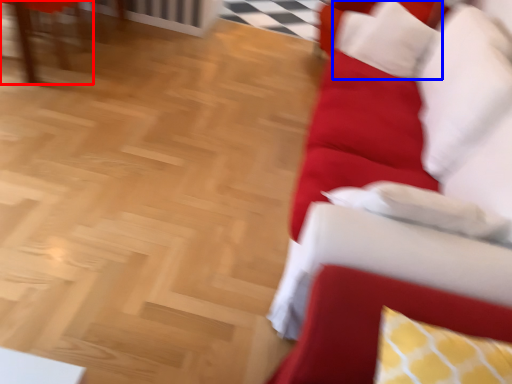
Question: Which point is further to the camera, furniture (highlighted by a red box) or pillow (highlighted by a blue box)?

Choices:
 (A) furniture
 (B) pillow

Answer: (A)